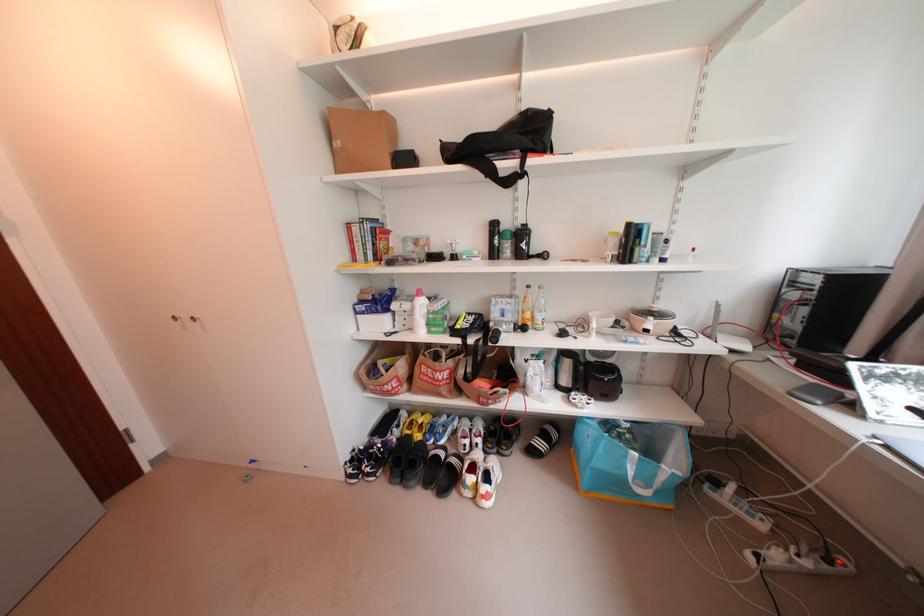
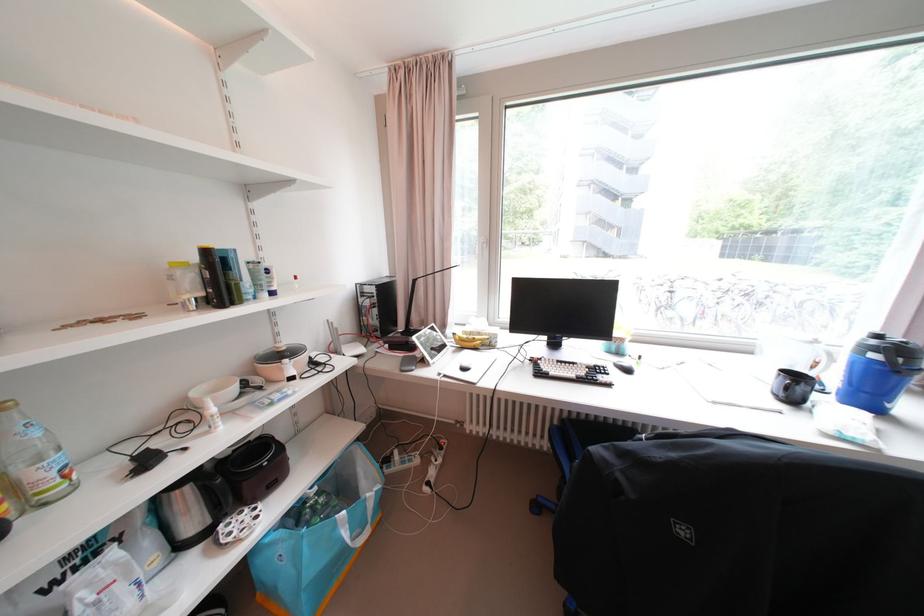
Where in the second image is the point corresponding to [638,474] from the first image?

(354, 537)